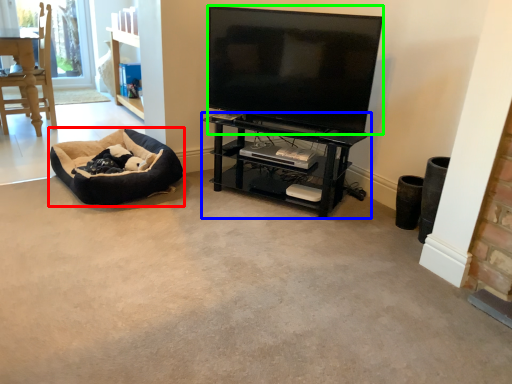
Question: Estimate the real-world distances between objects in this image. Which object is closer to dog bed (highlighted by a red box), shelf (highlighted by a blue box) or television (highlighted by a green box)?

Choices:
 (A) shelf
 (B) television

Answer: (A)